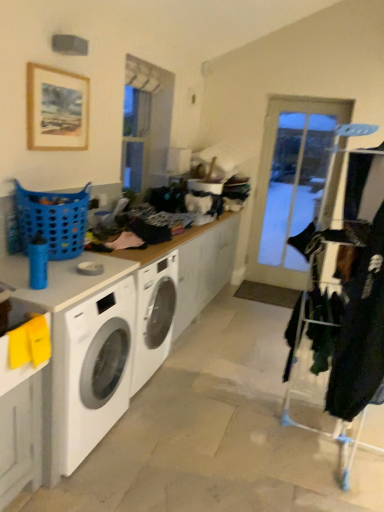
Describe the element at coordinates (92, 370) in the screenshot. Image resolution: width=384 pixels, height=512 pixels. I see `white glossy washing machine at lower left` at that location.

What do you see at coordinates (290, 183) in the screenshot? The image size is (384, 512). I see `clear glass screen door at center` at bounding box center [290, 183].

What is the approximate width of clear glass screen door at center?

clear glass screen door at center is 6.64 inches in width.

In order to click on blue plastic laundry basket at left in this screenshot , I will do (x=53, y=220).

What do you see at coordinates (53, 220) in the screenshot? Image resolution: width=384 pixels, height=512 pixels. I see `blue plastic laundry basket at left` at bounding box center [53, 220].

Identify the location of wooden picture frame at upper left. (56, 109).

Describe the element at coordinates (360, 293) in the screenshot. The image size is (384, 512). I see `velvet black coat at right` at that location.

Where is `white glossy washing machine at lower left`? The image size is (384, 512). white glossy washing machine at lower left is located at coordinates (92, 370).

Is metal/textured clothes rack at right completely or partially outside of yellow matte sink at lower left?

Yes, metal/textured clothes rack at right is outside of yellow matte sink at lower left.

From a real-world perspective, which object stands above the other?

In real-world perspective, yellow matte sink at lower left is above.

Can you confirm if metal/textured clothes rack at right is smaller than yellow matte sink at lower left?

No, metal/textured clothes rack at right is not smaller than yellow matte sink at lower left.

Which of these two, metal/textured clothes rack at right or yellow matte sink at lower left, is wider?

metal/textured clothes rack at right is wider.

Is white laminate counter top at center facing away from clear glass screen door at center?

No.

Based on the photo, from a real-world perspective, which object rests below the other?

In real-world perspective, white laminate counter top at center is lower.

Which is behind, white laminate counter top at center or clear glass screen door at center?

clear glass screen door at center is more distant.

Can you tell me how much white laminate counter top at center and clear glass screen door at center differ in facing direction?

white laminate counter top at center and clear glass screen door at center are facing 87.6 degrees away from each other.

From their relative heights in the image, would you say velvet black coat at right is taller or shorter than white glossy washing machine at lower left?

Considering their sizes, velvet black coat at right has more height than white glossy washing machine at lower left.

From a real-world perspective, is velvet black coat at right above or below white glossy washing machine at lower left?

velvet black coat at right is above white glossy washing machine at lower left.

Which of these two, velvet black coat at right or white glossy washing machine at lower left, is smaller?

velvet black coat at right is smaller.

Can you confirm if velvet black coat at right is wider than white glossy washing machine at lower left?

Incorrect, the width of velvet black coat at right does not surpass that of white glossy washing machine at lower left.

Is blue plastic laundry basket at left surrounding yellow matte sink at lower left?

No.

Can you confirm if blue plastic laundry basket at left is positioned to the right of yellow matte sink at lower left?

Correct, you'll find blue plastic laundry basket at left to the right of yellow matte sink at lower left.

Does blue plastic laundry basket at left have a lesser height compared to yellow matte sink at lower left?

No.

Is blue plastic laundry basket at left positioned behind yellow matte sink at lower left?

Yes, blue plastic laundry basket at left is further from the camera.

Considering the sizes of objects yellow matte sink at lower left and clear glass screen door at center in the image provided, who is taller, yellow matte sink at lower left or clear glass screen door at center?

Standing taller between the two is clear glass screen door at center.

Is yellow matte sink at lower left located outside clear glass screen door at center?

Yes, yellow matte sink at lower left is not within clear glass screen door at center.

Considering the sizes of objects yellow matte sink at lower left and clear glass screen door at center in the image provided, who is thinner, yellow matte sink at lower left or clear glass screen door at center?

clear glass screen door at center is thinner.

What's the angular difference between yellow matte sink at lower left and clear glass screen door at center's facing directions?

95.5 degrees separate the facing orientations of yellow matte sink at lower left and clear glass screen door at center.

Which object is wider, wooden picture frame at upper left or velvet black coat at right?

Wider between the two is velvet black coat at right.

Image resolution: width=384 pixels, height=512 pixels. I want to click on clothing on the right of wooden picture frame at upper left, so click(x=360, y=293).

Considering the sizes of objects wooden picture frame at upper left and velvet black coat at right in the image provided, who is shorter, wooden picture frame at upper left or velvet black coat at right?

With less height is wooden picture frame at upper left.

Are wooden picture frame at upper left and velvet black coat at right located far from each other?

wooden picture frame at upper left is positioned a significant distance from velvet black coat at right.

Considering the relative sizes of yellow matte sink at lower left and metal/textured clothes rack at right in the image provided, is yellow matte sink at lower left smaller than metal/textured clothes rack at right?

Indeed, yellow matte sink at lower left has a smaller size compared to metal/textured clothes rack at right.

Considering the sizes of yellow matte sink at lower left and metal/textured clothes rack at right in the image, is yellow matte sink at lower left wider or thinner than metal/textured clothes rack at right?

yellow matte sink at lower left is thinner than metal/textured clothes rack at right.

Can you confirm if yellow matte sink at lower left is shorter than metal/textured clothes rack at right?

Indeed, yellow matte sink at lower left has a lesser height compared to metal/textured clothes rack at right.

I want to click on sink that is on the left side of metal/textured clothes rack at right, so click(10, 310).

Identify the location of counter top in front of the clear glass screen door at center. Image resolution: width=384 pixels, height=512 pixels. (123, 327).

From the image, which object appears to be nearer to white glossy washing machine at lower left, white laminate counter top at center or metal/textured clothes rack at right?

white laminate counter top at center is positioned closer to the anchor white glossy washing machine at lower left.

Considering their positions, is clear glass screen door at center positioned closer to velvet black coat at right than metal/textured clothes rack at right?

metal/textured clothes rack at right.

Estimate the real-world distances between objects in this image. Which object is closer to white laminate counter top at center, yellow matte sink at lower left or velvet black coat at right?

Among the two, yellow matte sink at lower left is located nearer to white laminate counter top at center.

From the image, which object appears to be farther from velvet black coat at right, white glossy washing machine at lower left or blue plastic laundry basket at left?

Among the two, blue plastic laundry basket at left is located further to velvet black coat at right.

When comparing their distances from white glossy washing machine at lower left, does clear glass screen door at center or white laminate counter top at center seem further?

clear glass screen door at center is further to white glossy washing machine at lower left.

From the image, which object appears to be farther from wooden picture frame at upper left, blue plastic laundry basket at left or yellow matte sink at lower left?

yellow matte sink at lower left.

Which object lies further to the anchor point yellow matte sink at lower left, clear glass screen door at center or wooden picture frame at upper left?

The object further to yellow matte sink at lower left is clear glass screen door at center.

Based on their spatial positions, is yellow matte sink at lower left or metal/textured clothes rack at right closer to velvet black coat at right?

metal/textured clothes rack at right is positioned closer to the anchor velvet black coat at right.

The height and width of the screenshot is (512, 384). What are the coordinates of `sink between wooden picture frame at upper left and white glossy washing machine at lower left in the vertical direction` in the screenshot? It's located at (10, 310).

Where is `basket between yellow matte sink at lower left and metal/textured clothes rack at right in the horizontal direction`? basket between yellow matte sink at lower left and metal/textured clothes rack at right in the horizontal direction is located at coordinates (53, 220).

In order to click on basket between white laminate counter top at center and clear glass screen door at center along the z-axis in this screenshot , I will do `click(53, 220)`.

Locate an element on the screen. counter top between white glossy washing machine at lower left and metal/textured clothes rack at right in the horizontal direction is located at coordinates (123, 327).